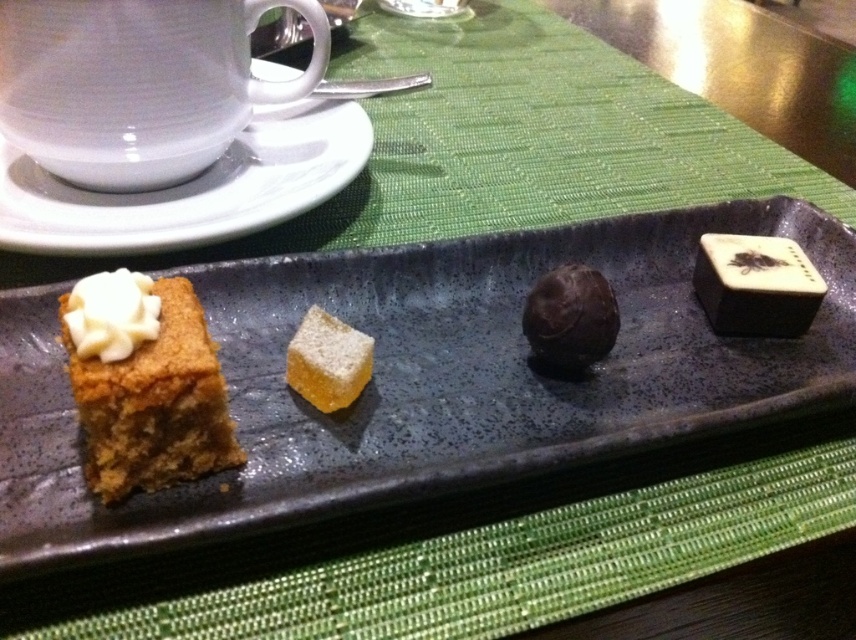
You are standing in front of the plate and want to pick up the dessert that is closest to you. Which dessert should you choose between the point at (275, 74) and the point at (590, 355)?

Point (275, 74) is behind point (590, 355), so the dessert at point (590, 355) is closer to you and should be chosen.

You are a food delivery robot with a 10 inch wide arm. You need to pick up the yellow sugary cube at center from the plate. Can your arm fit between the white ceramic saucer at upper left and the edge of the plate without touching anything?

The distance between the white ceramic saucer at upper left and the yellow sugary cube at center is 10.30 inches. Since your arm is 10 inches wide, there is enough space for it to fit between them without touching anything.

You are at a dessert buffet and see the white ceramic saucer at upper left and the yellow sugary cube at center. Which dessert is placed higher on the plate?

The white ceramic saucer at upper left is located above the yellow sugary cube at center, so it is placed higher on the plate.